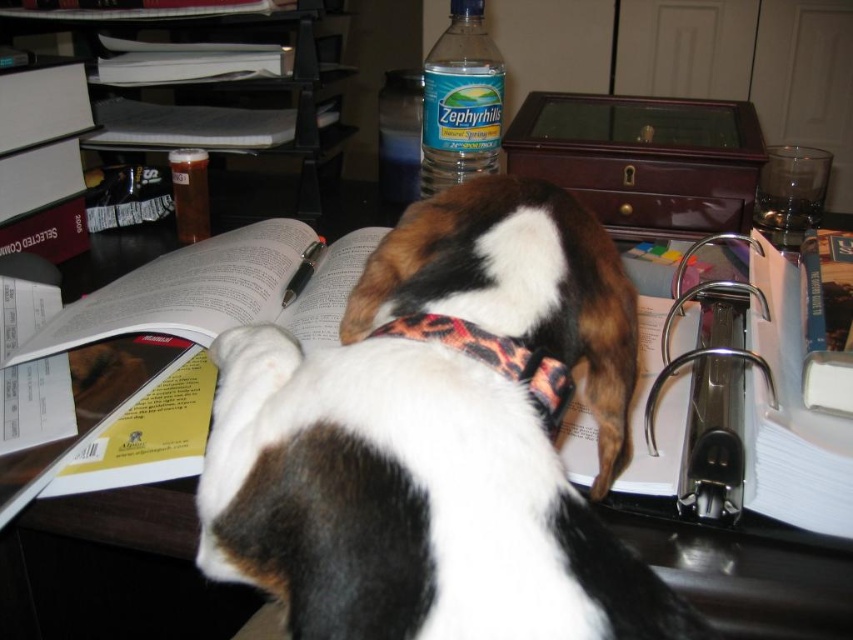
You are organizing the desk and need to place a new item between the clear plastic bottle at upper center and the leopard print fabric neckband at center. Based on their positions, which object should be on the left side of the new item?

The clear plastic bottle at upper center is to the left of leopard print fabric neckband at center. Therefore, to place the new item between them, the clear plastic bottle at upper center should be on the left side of the new item.

You are a photographer trying to capture a closeup of the brown and white fur at center. The camera you are using has a minimum focusing distance of 10 inches. Based on the scene, will you be able to take the photo without moving the camera closer?

The brown and white fur at center and viewer are 9.50 inches apart from each other, which is within the camera minimum focusing distance of 10 inches. Therefore, you can take the photo without moving the camera closer.